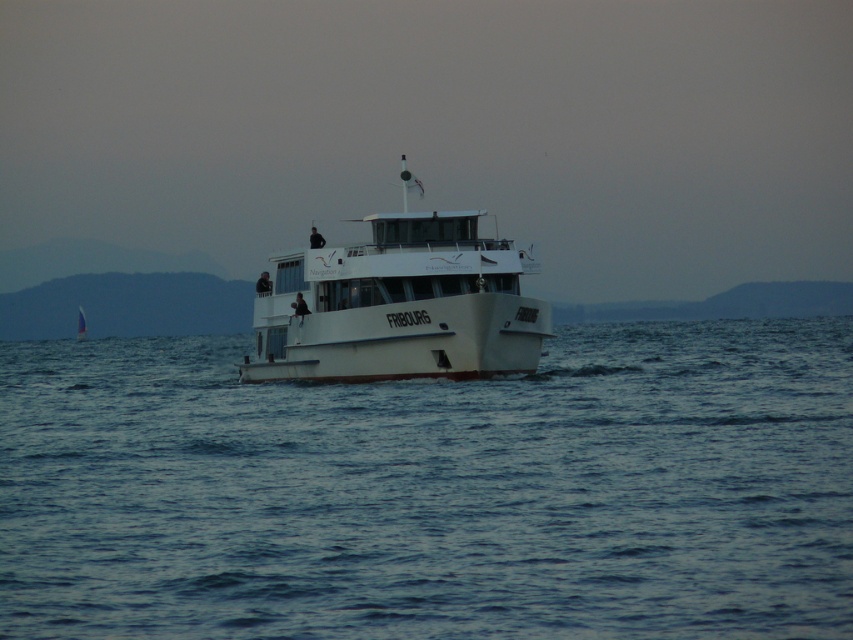
Looking at this image, is blue water at center positioned in front of white matte boat at center?

Yes, blue water at center is in front of white matte boat at center.

Consider the image. Can you confirm if blue water at center is positioned below white matte boat at center?

Yes, blue water at center is below white matte boat at center.

Does point (44, 417) come in front of point (287, 260)?

Yes, it is in front of point (287, 260).

Locate an element on the screen. This screenshot has height=640, width=853. blue water at center is located at coordinates (433, 492).